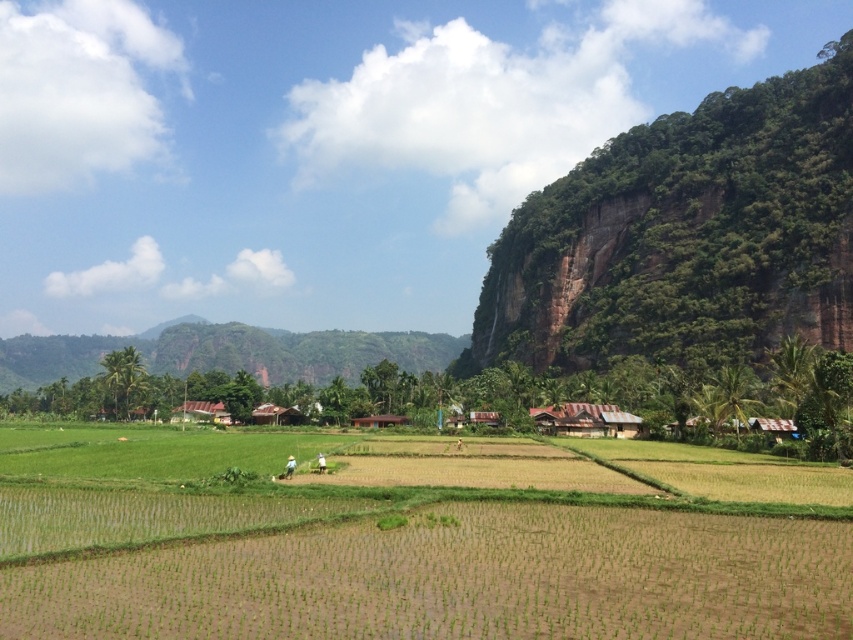
Is green textured cliff at upper right to the right of green grassy hillside at center from the viewer's perspective?

Yes, green textured cliff at upper right is to the right of green grassy hillside at center.

Does green textured cliff at upper right have a greater width compared to green grassy hillside at center?

No.

Is point (744, 112) positioned after point (173, 330)?

No, (744, 112) is in front of (173, 330).

Find the location of a particular element. This screenshot has width=853, height=640. green textured cliff at upper right is located at coordinates (686, 236).

Does green grassy field at center appear on the left side of green grassy hillside at center?

Incorrect, green grassy field at center is not on the left side of green grassy hillside at center.

Between point (137, 636) and point (352, 348), which one is positioned in front?

Point (137, 636)

Where is `green grassy field at center`? The image size is (853, 640). green grassy field at center is located at coordinates (409, 568).

What do you see at coordinates (409, 568) in the screenshot?
I see `green grassy field at center` at bounding box center [409, 568].

Is green grassy field at center to the left of green textured cliff at upper right from the viewer's perspective?

Yes, green grassy field at center is to the left of green textured cliff at upper right.

Identify the location of green grassy field at center. The image size is (853, 640). (409, 568).